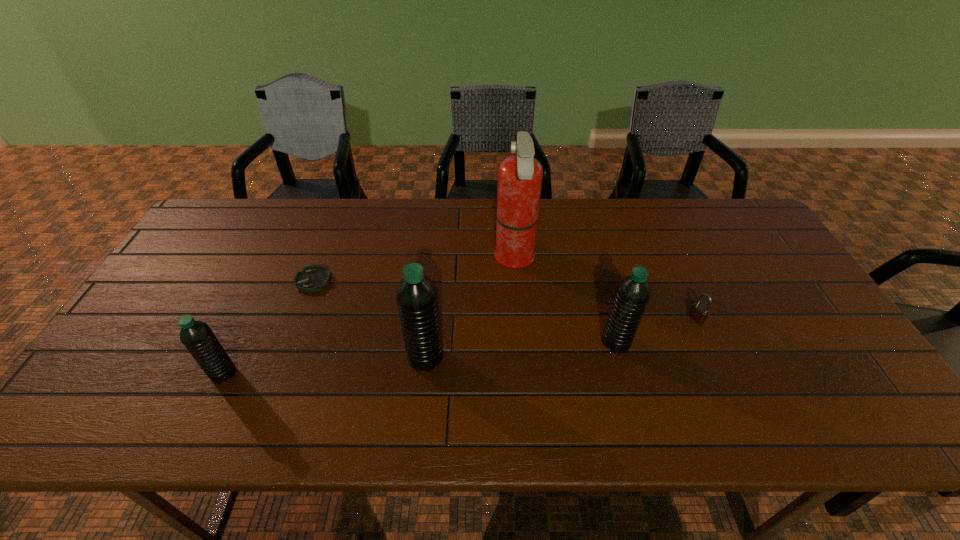
Locate an element on the screen. The width and height of the screenshot is (960, 540). fire extinguisher is located at coordinates (520, 176).

The height and width of the screenshot is (540, 960). I want to click on the tallest object, so click(520, 176).

At what (x,y) coordinates should I click in order to perform the action: click on free space located on the right of the fourth tallest object. Please return your answer as a coordinate pair (x, y). The height and width of the screenshot is (540, 960). Looking at the image, I should click on (302, 374).

Find the location of a particular element. free spot located 0.320m on the left of the second tallest object is located at coordinates (277, 357).

Where is `free spot located 0.400m on the left of the rightmost water bottle`? The height and width of the screenshot is (540, 960). free spot located 0.400m on the left of the rightmost water bottle is located at coordinates (444, 342).

I want to click on blank space located on the front of the fifth tallest object, so click(x=723, y=378).

Where is `free space located 0.320m on the right of the shortest object`? The image size is (960, 540). free space located 0.320m on the right of the shortest object is located at coordinates (442, 280).

Where is `free location located 0.370m with the handle and hose on the fire extinguisher`? This screenshot has width=960, height=540. free location located 0.370m with the handle and hose on the fire extinguisher is located at coordinates (372, 258).

Identify the location of free space located 0.360m with the handle and hose on the fire extinguisher. This screenshot has height=540, width=960. (375, 258).

This screenshot has height=540, width=960. Find the location of `free space located 0.270m with the handle and hose on the fire extinguisher`. free space located 0.270m with the handle and hose on the fire extinguisher is located at coordinates (405, 258).